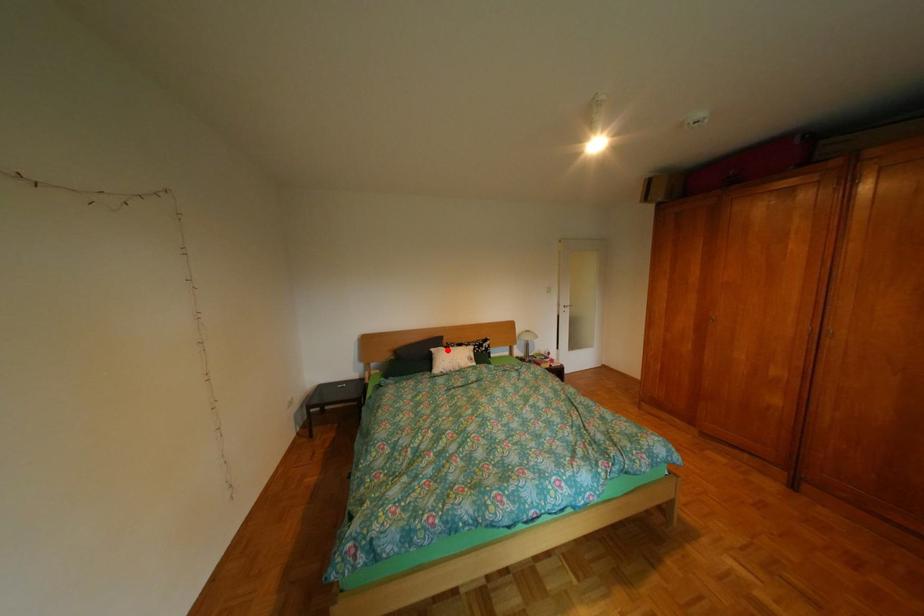
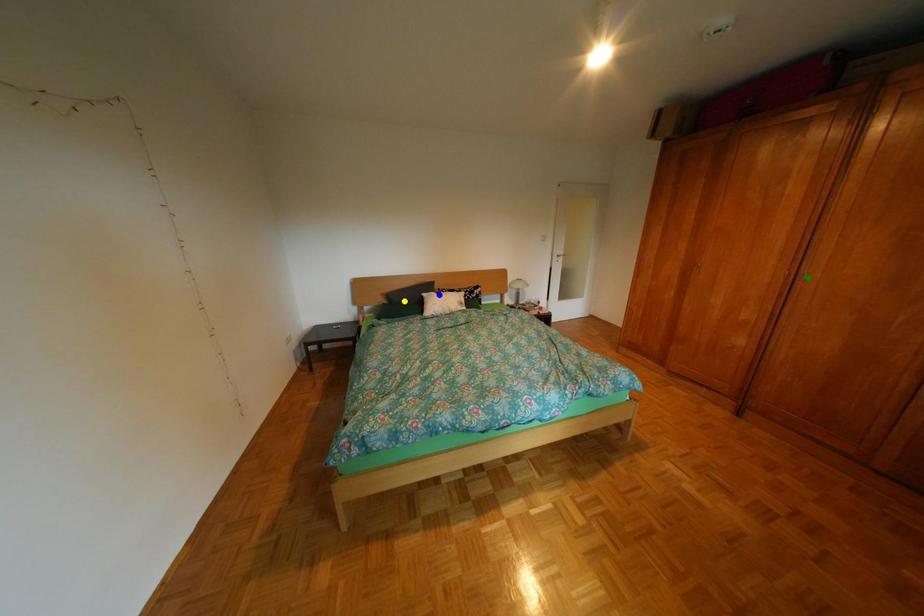
Question: I am providing you with two images of the same scene from different viewpoints. A red point is marked on the first image. You are given multiple points on the second image. Which point in image 2 is actually the same real-world point as the red point in image 1?

Choices:
 (A) green point
 (B) yellow point
 (C) blue point

Answer: (C)